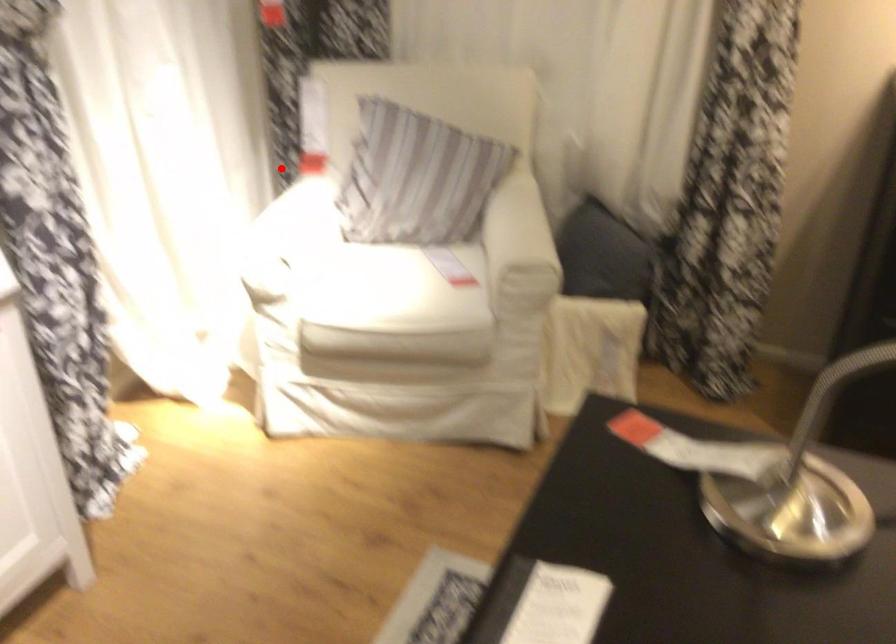
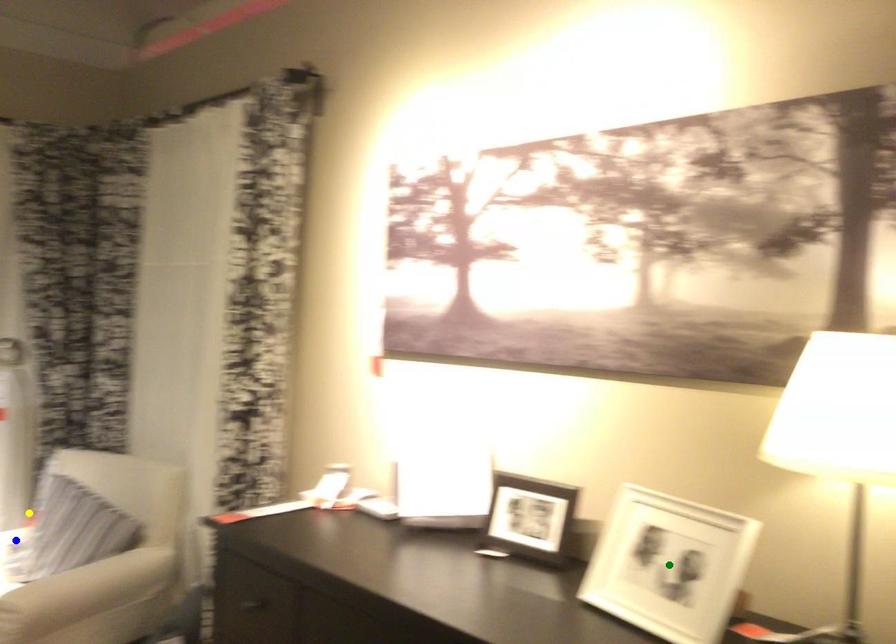
Question: I am providing you with two images of the same scene from different viewpoints. A red point is marked on the first image. You are given multiple points on the second image. Which spot in image 2 lines up with the point in image 1?

Choices:
 (A) green point
 (B) yellow point
 (C) blue point

Answer: (B)